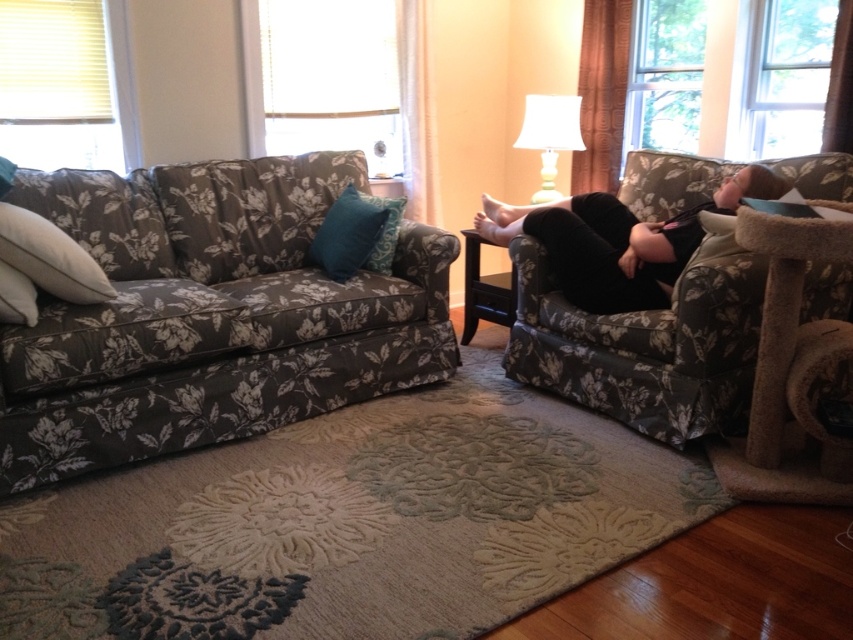
Question: Can you confirm if black velvet pants at right is thinner than white soft pillow at left?

Choices:
 (A) yes
 (B) no

Answer: (B)

Question: Which point appears farthest from the camera in this image?

Choices:
 (A) (746, 180)
 (B) (546, 180)

Answer: (B)

Question: Which of the following is the closest to the observer?

Choices:
 (A) teal fabric pillow at center
 (B) floral fabric couch at left

Answer: (B)

Question: In this image, where is floral fabric couch at left located relative to soft white pillow at left?

Choices:
 (A) above
 (B) below

Answer: (A)

Question: Does black velvet pants at right have a larger size compared to teal fabric pillow at center?

Choices:
 (A) yes
 (B) no

Answer: (A)

Question: Among these objects, which one is nearest to the camera?

Choices:
 (A) teal fabric pillow at center
 (B) floral fabric couch at left
 (C) floral fabric armchair at right
 (D) white fabric lampshade at upper right

Answer: (B)